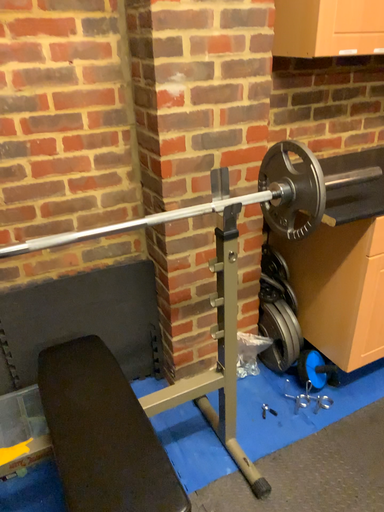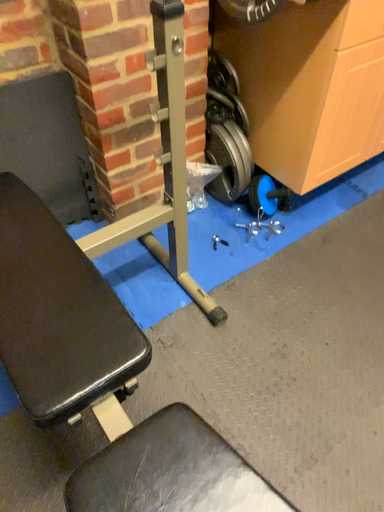
Question: How did the camera likely rotate when shooting the video?

Choices:
 (A) rotated right
 (B) rotated left

Answer: (A)